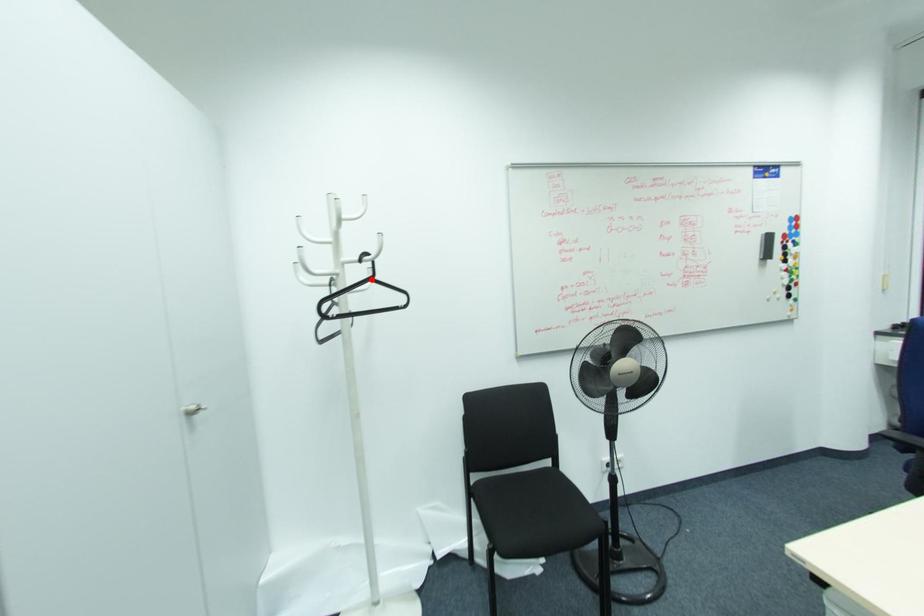
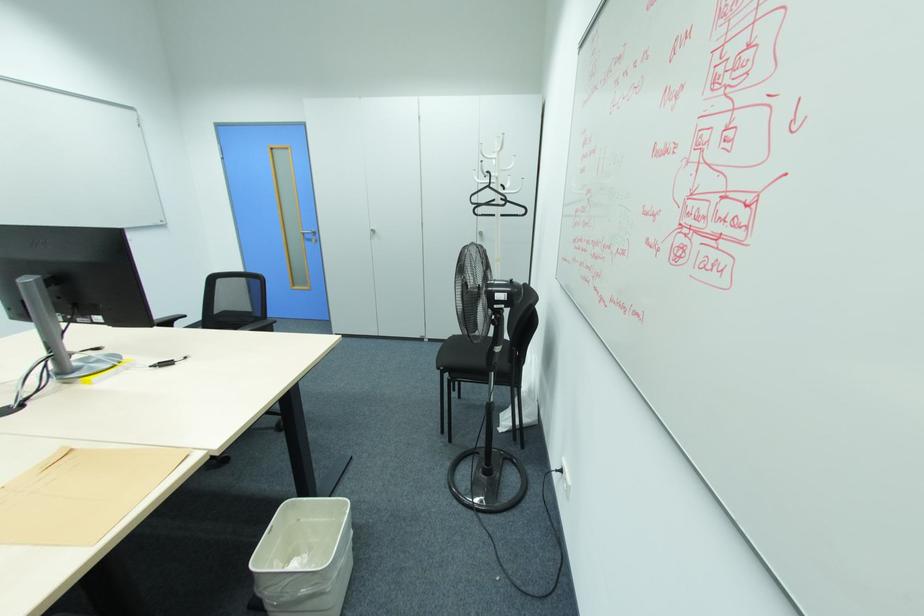
Where in the second image is the point corresponding to the highlighted location from the first image?

(490, 187)